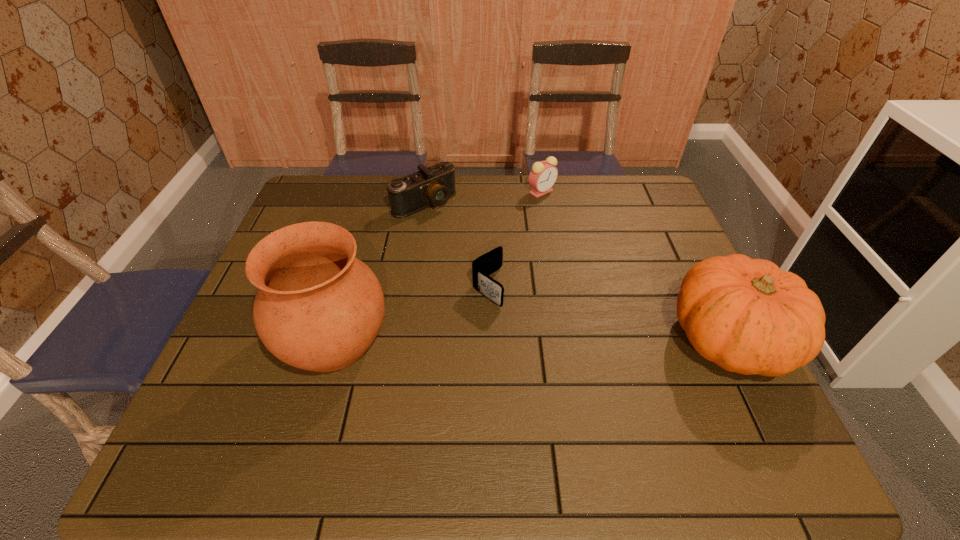
Where is `free space between the fourth object from left to right and the tallest object`? Image resolution: width=960 pixels, height=540 pixels. free space between the fourth object from left to right and the tallest object is located at coordinates (438, 266).

The width and height of the screenshot is (960, 540). I want to click on blank region between the pumpkin and the tallest object, so click(x=532, y=340).

Find the location of `blank region between the tallest object and the fourth shortest object`. blank region between the tallest object and the fourth shortest object is located at coordinates (532, 340).

You are a GUI agent. You are given a task and a screenshot of the screen. Output one action in this format:
    pyautogui.click(x=<x>, y=<y>)
    Task: Click on the closest object to the alarm clock
    
    Given the screenshot: What is the action you would take?
    pyautogui.click(x=434, y=185)

In order to click on the fourth closest object to the alarm clock in this screenshot , I will do `click(318, 308)`.

Find the location of `free space in the image that satisfies the following two spatial constraints: 1. on the front side of the rightmost object; 2. on the left side of the third object from left to right`. free space in the image that satisfies the following two spatial constraints: 1. on the front side of the rightmost object; 2. on the left side of the third object from left to right is located at coordinates click(x=489, y=339).

Where is `vacant region that satisfies the following two spatial constraints: 1. on the front side of the fourth shortest object; 2. on the left side of the camera`? The image size is (960, 540). vacant region that satisfies the following two spatial constraints: 1. on the front side of the fourth shortest object; 2. on the left side of the camera is located at coordinates (404, 339).

At what (x,y) coordinates should I click in order to perform the action: click on free region that satisfies the following two spatial constraints: 1. on the front side of the fourth object from left to right; 2. on the left side of the rightmost object. Please return your answer as a coordinate pair (x, y). Image resolution: width=960 pixels, height=540 pixels. Looking at the image, I should click on (567, 339).